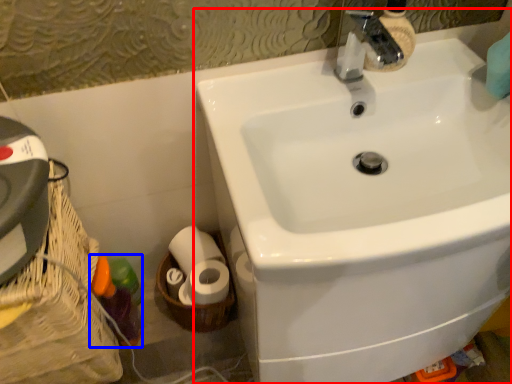
Question: Which object appears farthest to the camera in this image, sink (highlighted by a red box) or bottle (highlighted by a blue box)?

Choices:
 (A) sink
 (B) bottle

Answer: (B)